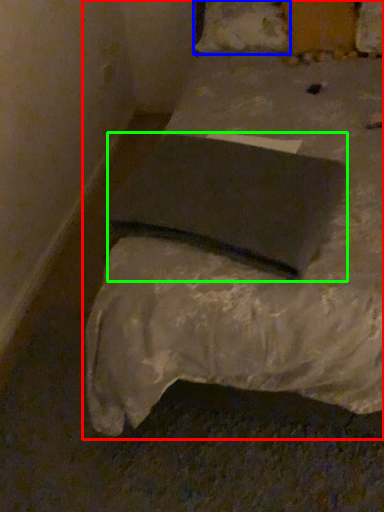
Question: Which is farther away from bed (highlighted by a red box)? pillow (highlighted by a blue box) or pad (highlighted by a green box)?

Choices:
 (A) pillow
 (B) pad

Answer: (A)